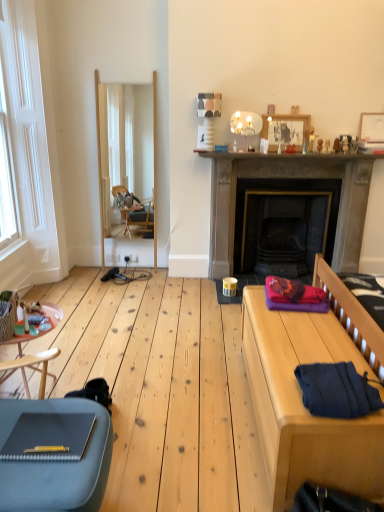
Where is `empty space that is ontop of stone fireplace mantel at center (from a real-world perspective)`? This screenshot has height=512, width=384. empty space that is ontop of stone fireplace mantel at center (from a real-world perspective) is located at coordinates (298, 150).